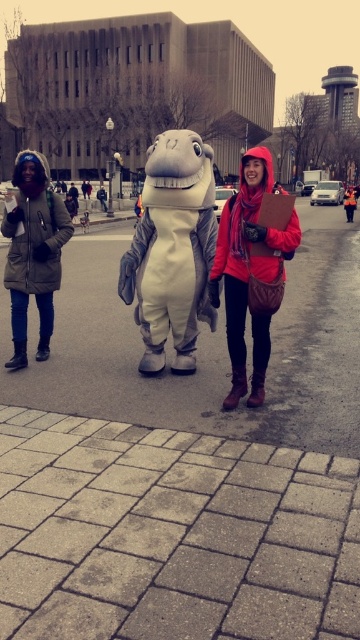
You are standing at the point marked by coordinates point (205, 348) in the image. What is the object located exactly at this point?

The object located exactly at point (205, 348) is brick pavement at center.

You are a photographer trying to capture the brick pavement at center and the matte red scarf at center in the same frame. Based on their positions, which object should you focus on first to ensure both are in focus?

The brick pavement at center is much taller than the matte red scarf at center, so you should focus on the brick pavement at center first to ensure both are in focus.